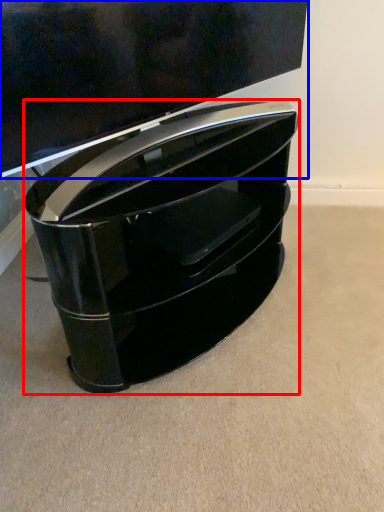
Question: Which object appears closest to the camera in this image, furniture (highlighted by a red box) or television (highlighted by a blue box)?

Choices:
 (A) furniture
 (B) television

Answer: (B)